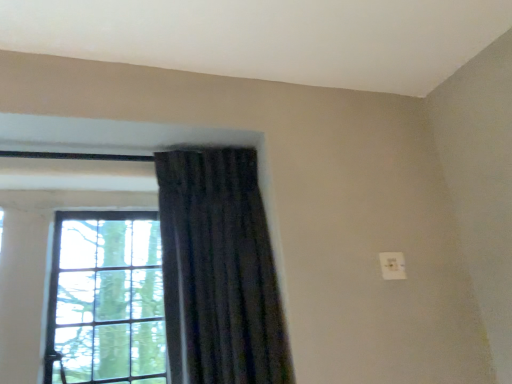
What do you see at coordinates (82, 275) in the screenshot? I see `clear glass window at left` at bounding box center [82, 275].

The height and width of the screenshot is (384, 512). In order to click on clear glass window at left in this screenshot , I will do `click(82, 275)`.

Measure the distance between point (83, 242) and camera.

4.57 feet.

Where is `dark fabric curtain at center`? dark fabric curtain at center is located at coordinates (219, 271).

What do you see at coordinates (219, 271) in the screenshot? I see `dark fabric curtain at center` at bounding box center [219, 271].

The height and width of the screenshot is (384, 512). In order to click on clear glass window at left in this screenshot , I will do `click(82, 275)`.

Based on their positions, is dark fabric curtain at center located to the left or right of clear glass window at left?

dark fabric curtain at center is to the right of clear glass window at left.

Considering their positions, is dark fabric curtain at center located in front of or behind clear glass window at left?

dark fabric curtain at center is positioned closer to the viewer than clear glass window at left.

Which is less distant, [214,376] or [156,183]?

Point [214,376].

Looking at this image, from the image's perspective, which object appears higher, dark fabric curtain at center or clear glass window at left?

dark fabric curtain at center is shown above in the image.

From a real-world perspective, which is physically above, dark fabric curtain at center or clear glass window at left?

In real-world perspective, clear glass window at left is above.

Which of these two, dark fabric curtain at center or clear glass window at left, is thinner?

clear glass window at left is thinner.

Does dark fabric curtain at center have a lesser height compared to clear glass window at left?

No.

In terms of size, does dark fabric curtain at center appear bigger or smaller than clear glass window at left?

Clearly, dark fabric curtain at center is larger in size than clear glass window at left.

Which is correct: dark fabric curtain at center is inside clear glass window at left, or outside of it?

dark fabric curtain at center lies outside clear glass window at left.

Is dark fabric curtain at center touching clear glass window at left?

No, dark fabric curtain at center is not making contact with clear glass window at left.

Is dark fabric curtain at center looking in the opposite direction of clear glass window at left?

dark fabric curtain at center does not have its back to clear glass window at left.

The height and width of the screenshot is (384, 512). Identify the location of window that is on the left side of dark fabric curtain at center. (82, 275).

Can you confirm if clear glass window at left is positioned to the right of dark fabric curtain at center?

Incorrect, clear glass window at left is not on the right side of dark fabric curtain at center.

Between clear glass window at left and dark fabric curtain at center, which one is positioned in front?

dark fabric curtain at center is in front.

Which is closer, (45, 219) or (277, 345)?

The point (277, 345) is in front.

Consider the image. From the image's perspective, which is above, clear glass window at left or dark fabric curtain at center?

dark fabric curtain at center, from the image's perspective.

From a real-world perspective, is clear glass window at left beneath dark fabric curtain at center?

Incorrect, from a real-world perspective, clear glass window at left is higher than dark fabric curtain at center.

Is clear glass window at left thinner than dark fabric curtain at center?

Correct, the width of clear glass window at left is less than that of dark fabric curtain at center.

Between clear glass window at left and dark fabric curtain at center, which one has less height?

With less height is clear glass window at left.

Can you confirm if clear glass window at left is smaller than dark fabric curtain at center?

Yes.

Is dark fabric curtain at center completely or partially inside clear glass window at left?

No, dark fabric curtain at center is not a part of clear glass window at left.

Are clear glass window at left and dark fabric curtain at center far apart?

That's not correct — clear glass window at left is a little close to dark fabric curtain at center.

Does clear glass window at left turn towards dark fabric curtain at center?

No, clear glass window at left does not turn towards dark fabric curtain at center.

How many degrees apart are the facing directions of clear glass window at left and dark fabric curtain at center?

3.43 degrees.

Where is `curtain on the right side of clear glass window at left`? This screenshot has height=384, width=512. curtain on the right side of clear glass window at left is located at coordinates (219, 271).

The width and height of the screenshot is (512, 384). I want to click on curtain on the right of the clear glass window at left, so click(x=219, y=271).

Identify the location of curtain above the clear glass window at left (from the image's perspective). The height and width of the screenshot is (384, 512). (219, 271).